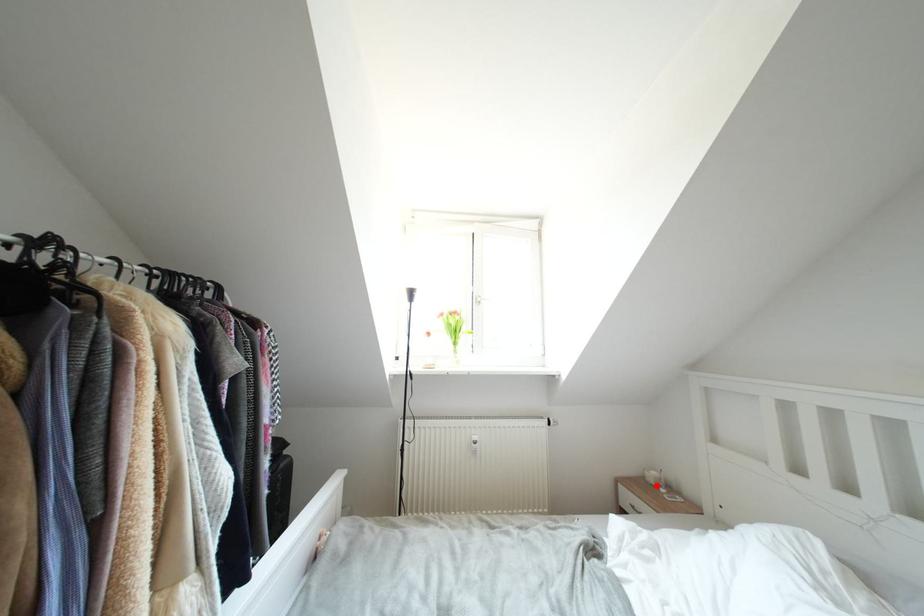
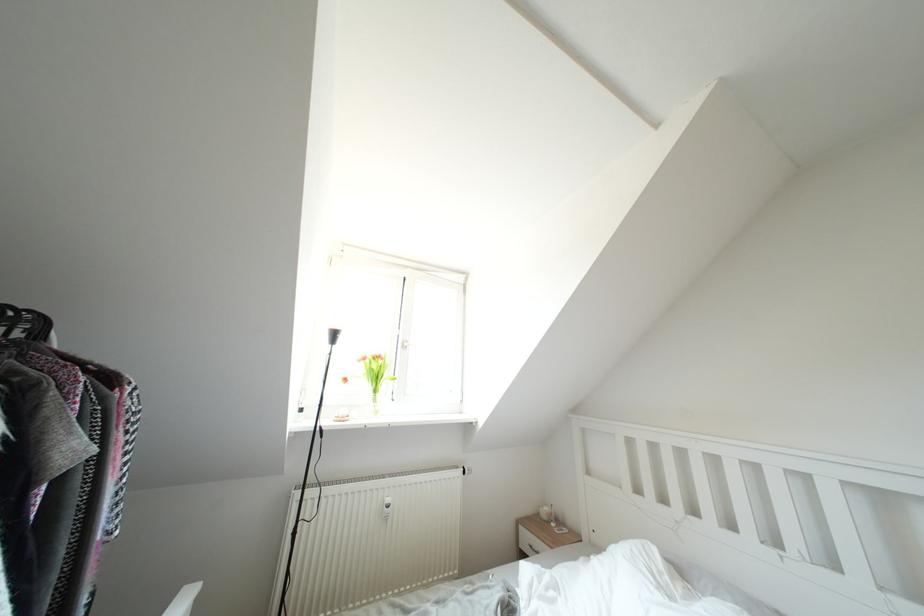
In the second image, find the point that corresponds to the highlighted location in the first image.

(550, 522)